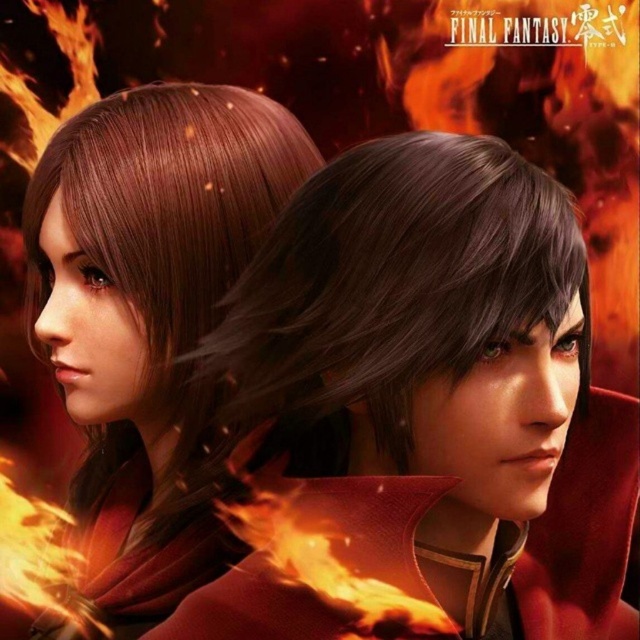
What do you see at coordinates (438, 387) in the screenshot? The width and height of the screenshot is (640, 640). I see `shiny brown hair at upper left` at bounding box center [438, 387].

Identify the location of shiny brown hair at upper left. (438, 387).

Locate an element on the screen. Image resolution: width=640 pixels, height=640 pixels. shiny brown hair at upper left is located at coordinates (438, 387).